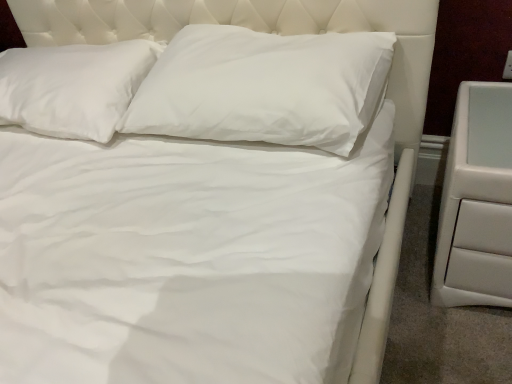
Describe the element at coordinates (73, 87) in the screenshot. The width and height of the screenshot is (512, 384). I see `white soft pillow at upper center, the 2th pillow in the right-to-left sequence` at that location.

What do you see at coordinates (476, 201) in the screenshot? This screenshot has width=512, height=384. I see `white leather nightstand at right` at bounding box center [476, 201].

What is the approximate width of white smooth pillow at center, positioned as the second pillow in left-to-right order?

The width of white smooth pillow at center, positioned as the second pillow in left-to-right order, is 15.81 inches.

This screenshot has width=512, height=384. In order to click on white soft pillow at upper center, the 1th pillow when ordered from left to right in this screenshot , I will do `click(73, 87)`.

In the image, is white smooth pillow at center, which is the 1th pillow from right to left, positioned in front of or behind white leather nightstand at right?

white smooth pillow at center, which is the 1th pillow from right to left, is positioned farther from the viewer than white leather nightstand at right.

In terms of width, does white smooth pillow at center, which is the 1th pillow from right to left, look wider or thinner when compared to white leather nightstand at right?

Clearly, white smooth pillow at center, which is the 1th pillow from right to left, has less width compared to white leather nightstand at right.

Based on the photo, which of these two, white smooth pillow at center, positioned as the second pillow in left-to-right order, or white leather nightstand at right, is bigger?

Bigger between the two is white smooth pillow at center, positioned as the second pillow in left-to-right order.

What are the coordinates of `pillow behind the white smooth pillow at center, which is the 1th pillow from right to left` in the screenshot? It's located at (73, 87).

Considering the positions of objects white soft pillow at upper center, the 1th pillow when ordered from left to right, and white smooth pillow at center, which is the 1th pillow from right to left, in the image provided, who is behind, white soft pillow at upper center, the 1th pillow when ordered from left to right, or white smooth pillow at center, which is the 1th pillow from right to left,?

white soft pillow at upper center, the 1th pillow when ordered from left to right, is further away from the camera.

Would you say white soft pillow at upper center, the 2th pillow in the right-to-left sequence, is inside or outside white smooth pillow at center, which is the 1th pillow from right to left?

white soft pillow at upper center, the 2th pillow in the right-to-left sequence, is spatially situated outside white smooth pillow at center, which is the 1th pillow from right to left.

Considering the sizes of objects white smooth pillow at center, which is the 1th pillow from right to left, and white soft pillow at upper center, the 1th pillow when ordered from left to right, in the image provided, who is taller, white smooth pillow at center, which is the 1th pillow from right to left, or white soft pillow at upper center, the 1th pillow when ordered from left to right,?

white smooth pillow at center, which is the 1th pillow from right to left, is taller.

Does white smooth pillow at center, positioned as the second pillow in left-to-right order, appear on the left side of white soft pillow at upper center, the 1th pillow when ordered from left to right?

No.

Is white soft pillow at upper center, the 2th pillow in the right-to-left sequence, at the back of white smooth pillow at center, which is the 1th pillow from right to left?

white smooth pillow at center, which is the 1th pillow from right to left, is not turned away from white soft pillow at upper center, the 2th pillow in the right-to-left sequence.

From the image's perspective, which one is positioned higher, white smooth pillow at center, positioned as the second pillow in left-to-right order, or white soft pillow at upper center, the 1th pillow when ordered from left to right?

white soft pillow at upper center, the 1th pillow when ordered from left to right.

In the image, there is a white soft pillow at upper center, the 2th pillow in the right-to-left sequence. Identify the location of nightstand below it (from the image's perspective). (476, 201).

Is white leather nightstand at right oriented towards white soft pillow at upper center, the 2th pillow in the right-to-left sequence?

No.

Consider the image. In terms of width, does white leather nightstand at right look wider or thinner when compared to white soft pillow at upper center, the 2th pillow in the right-to-left sequence?

white leather nightstand at right is wider than white soft pillow at upper center, the 2th pillow in the right-to-left sequence.

Is white smooth pillow at center, which is the 1th pillow from right to left, at the back of white leather nightstand at right?

No, white leather nightstand at right's orientation is not away from white smooth pillow at center, which is the 1th pillow from right to left.

Does point (455, 195) come behind point (302, 41)?

No, (455, 195) is closer to viewer.

Between white leather nightstand at right and white smooth pillow at center, which is the 1th pillow from right to left, which one is positioned behind?

white smooth pillow at center, which is the 1th pillow from right to left, is further away from the camera.

Is white leather nightstand at right touching white smooth pillow at center, positioned as the second pillow in left-to-right order?

No, white leather nightstand at right is not touching white smooth pillow at center, positioned as the second pillow in left-to-right order.

Is white soft pillow at upper center, the 1th pillow when ordered from left to right, inside the boundaries of white leather nightstand at right, or outside?

white soft pillow at upper center, the 1th pillow when ordered from left to right, cannot be found inside white leather nightstand at right.

From the picture: Measure the distance between white soft pillow at upper center, the 2th pillow in the right-to-left sequence, and white leather nightstand at right.

white soft pillow at upper center, the 2th pillow in the right-to-left sequence, is 3.39 feet away from white leather nightstand at right.

This screenshot has height=384, width=512. In order to click on nightstand below the white soft pillow at upper center, the 1th pillow when ordered from left to right (from the image's perspective) in this screenshot , I will do `click(476, 201)`.

In the image, there is a white smooth pillow at center, positioned as the second pillow in left-to-right order. Where is `nightstand below it (from the image's perspective)`? nightstand below it (from the image's perspective) is located at coordinates (476, 201).

Find the location of a particular element. pillow below the white smooth pillow at center, positioned as the second pillow in left-to-right order (from a real-world perspective) is located at coordinates (73, 87).

From the picture: From the image, which object appears to be farther from white soft pillow at upper center, the 2th pillow in the right-to-left sequence, white leather nightstand at right or white smooth pillow at center, positioned as the second pillow in left-to-right order?

Among the two, white leather nightstand at right is located further to white soft pillow at upper center, the 2th pillow in the right-to-left sequence.

Based on their spatial positions, is white smooth pillow at center, positioned as the second pillow in left-to-right order, or white leather nightstand at right further from white soft pillow at upper center, the 2th pillow in the right-to-left sequence?

Based on the image, white leather nightstand at right appears to be further to white soft pillow at upper center, the 2th pillow in the right-to-left sequence.

From the image, which object appears to be nearer to white smooth pillow at center, which is the 1th pillow from right to left, white soft pillow at upper center, the 1th pillow when ordered from left to right, or white leather nightstand at right?

Based on the image, white soft pillow at upper center, the 1th pillow when ordered from left to right, appears to be nearer to white smooth pillow at center, which is the 1th pillow from right to left.

When comparing their distances from white leather nightstand at right, does white soft pillow at upper center, the 1th pillow when ordered from left to right, or white smooth pillow at center, positioned as the second pillow in left-to-right order, seem further?

Among the two, white soft pillow at upper center, the 1th pillow when ordered from left to right, is located further to white leather nightstand at right.

Based on their spatial positions, is white leather nightstand at right or white soft pillow at upper center, the 1th pillow when ordered from left to right, further from white smooth pillow at center, positioned as the second pillow in left-to-right order?

white leather nightstand at right is positioned further to the anchor white smooth pillow at center, positioned as the second pillow in left-to-right order.

Considering their positions, is white smooth pillow at center, which is the 1th pillow from right to left, positioned closer to white leather nightstand at right than white soft pillow at upper center, the 1th pillow when ordered from left to right?

Among the two, white smooth pillow at center, which is the 1th pillow from right to left, is located nearer to white leather nightstand at right.

Where is `pillow between white soft pillow at upper center, the 1th pillow when ordered from left to right, and white leather nightstand at right`? pillow between white soft pillow at upper center, the 1th pillow when ordered from left to right, and white leather nightstand at right is located at coordinates (263, 87).